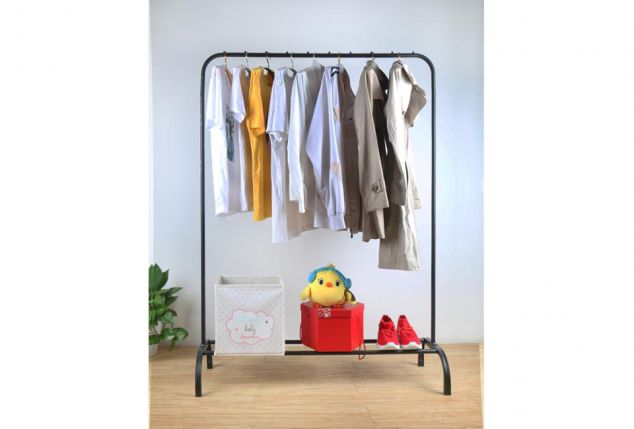
This screenshot has width=634, height=429. What are the coordinates of `hangers` in the screenshot? It's located at (223, 63), (243, 57), (262, 55), (293, 57), (309, 59), (339, 59), (372, 56), (401, 56).